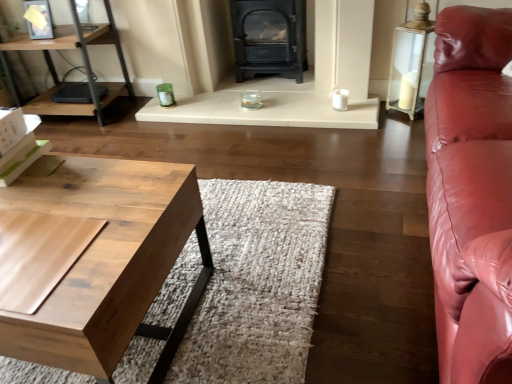
Where is `vacant area on top of natural wood coffee table at lower left (from a real-world perspective)`? This screenshot has height=384, width=512. vacant area on top of natural wood coffee table at lower left (from a real-world perspective) is located at coordinates (x=57, y=216).